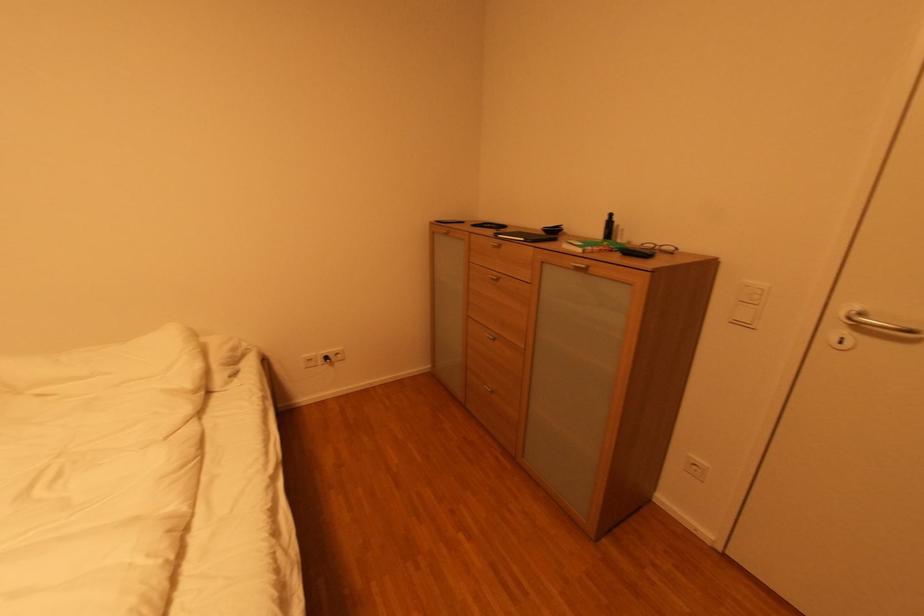
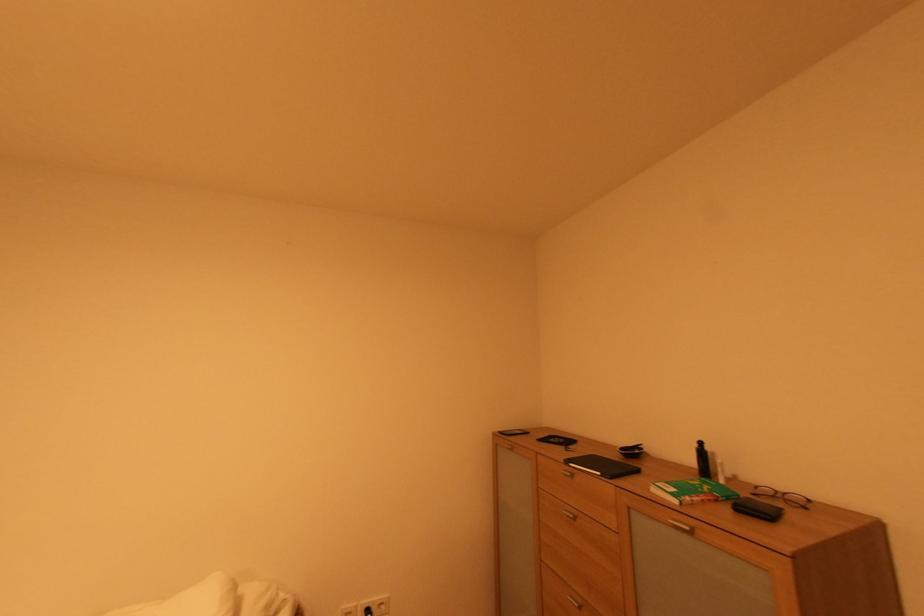
The point at (624, 256) is marked in the first image. Where is the corresponding point in the second image?

(734, 511)